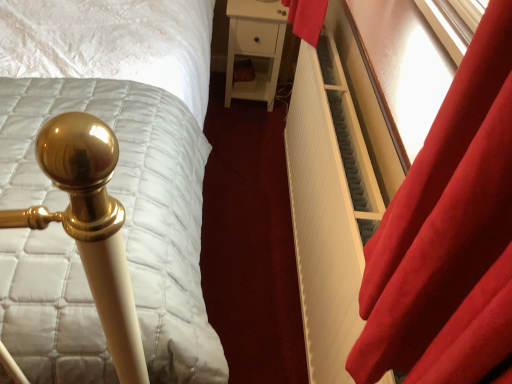
Question: Visually, is velvet red curtain at right positioned to the left or to the right of gold metallic bedpost at left?

Choices:
 (A) right
 (B) left

Answer: (A)

Question: Choose the correct answer: Is velvet red curtain at right inside gold metallic bedpost at left or outside it?

Choices:
 (A) inside
 (B) outside

Answer: (B)

Question: Based on their relative distances, which object is nearer to the white ribbed radiator at right?

Choices:
 (A) velvet red curtain at right
 (B) gold metallic bedpost at left
 (C) white matte nightstand at center

Answer: (A)

Question: Estimate the real-world distances between objects in this image. Which object is farther from the velvet red curtain at right?

Choices:
 (A) gold metallic bedpost at left
 (B) white ribbed radiator at right
 (C) white matte nightstand at center

Answer: (C)